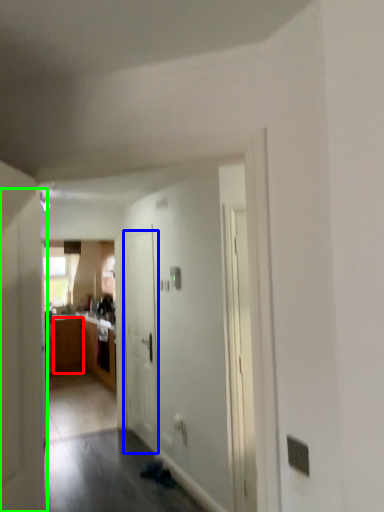
Question: Estimate the real-world distances between objects in this image. Which object is closer to cabinetry (highlighted by a red box), door (highlighted by a blue box) or door (highlighted by a green box)?

Choices:
 (A) door
 (B) door

Answer: (A)